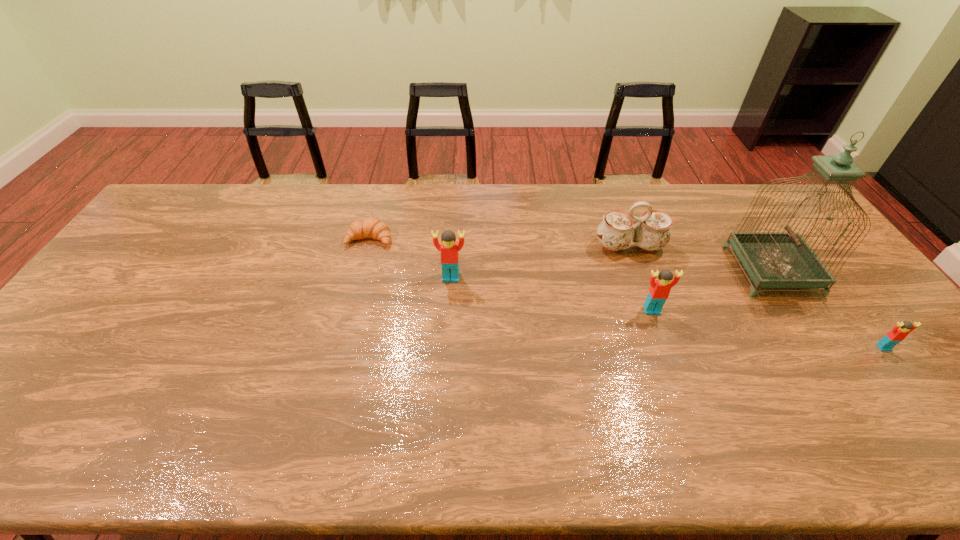
I want to click on vacant space in between the farthest Lego and the second object from right to left, so click(x=612, y=274).

Image resolution: width=960 pixels, height=540 pixels. I want to click on blank region between the tallest object and the chinaware, so click(701, 258).

The width and height of the screenshot is (960, 540). I want to click on free spot between the shortest object and the chinaware, so click(499, 242).

Locate an element on the screen. Image resolution: width=960 pixels, height=540 pixels. free space between the chinaware and the nearest Lego is located at coordinates (756, 297).

Image resolution: width=960 pixels, height=540 pixels. In order to click on vacant space that is in between the chinaware and the shortest object in this screenshot , I will do `click(499, 242)`.

Where is `free spot between the crescent roll and the fifth object from left to right`? Image resolution: width=960 pixels, height=540 pixels. free spot between the crescent roll and the fifth object from left to right is located at coordinates (570, 254).

You are a GUI agent. You are given a task and a screenshot of the screen. Output one action in this format:
    pyautogui.click(x=<x>, y=<y>)
    Task: Click on the object that stands as the second closest to the crescent roll
    
    Given the screenshot: What is the action you would take?
    pyautogui.click(x=617, y=231)

At what (x,y) coordinates should I click in order to perform the action: click on object that is the fourth closest to the leftmost Lego. Please return your answer as a coordinate pair (x, y). Looking at the image, I should click on (773, 259).

Find the location of a particular element. Image resolution: width=960 pixels, height=540 pixels. Lego that is the closest to the farthest Lego is located at coordinates (660, 288).

Point out which Lego is positioned as the nearest to the leftmost Lego. Please provide its 2D coordinates. Your answer should be formatted as a tuple, i.e. [(x, y)], where the tuple contains the x and y coordinates of a point satisfying the conditions above.

[(660, 288)]